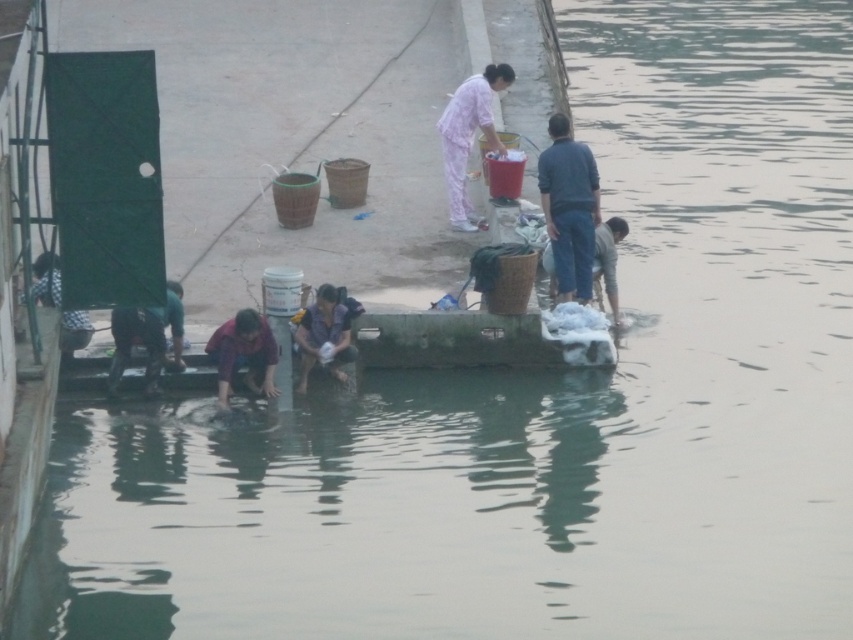
Question: Is blue denim jeans at center bigger than purple matte shirt at lower center?

Choices:
 (A) yes
 (B) no

Answer: (A)

Question: Considering the real-world distances, which object is closest to the blue denim jeans at center?

Choices:
 (A) purple matte shirt at lower center
 (B) pink fabric at center
 (C) dark blue jeans at lower left
 (D) purple fabric at lower center

Answer: (B)

Question: Does pink fabric at center lie behind purple fabric at lower center?

Choices:
 (A) no
 (B) yes

Answer: (B)

Question: Which object is closer to the camera taking this photo?

Choices:
 (A) purple matte shirt at lower center
 (B) dark blue jeans at lower left
 (C) purple fabric at lower center

Answer: (B)

Question: Can you confirm if pink fabric at center is wider than purple matte shirt at lower center?

Choices:
 (A) yes
 (B) no

Answer: (A)

Question: Which object appears farthest from the camera in this image?

Choices:
 (A) light brown fabric pants at lower right
 (B) dark blue jeans at lower left
 (C) purple fabric at lower center
 (D) pink fabric at center

Answer: (D)